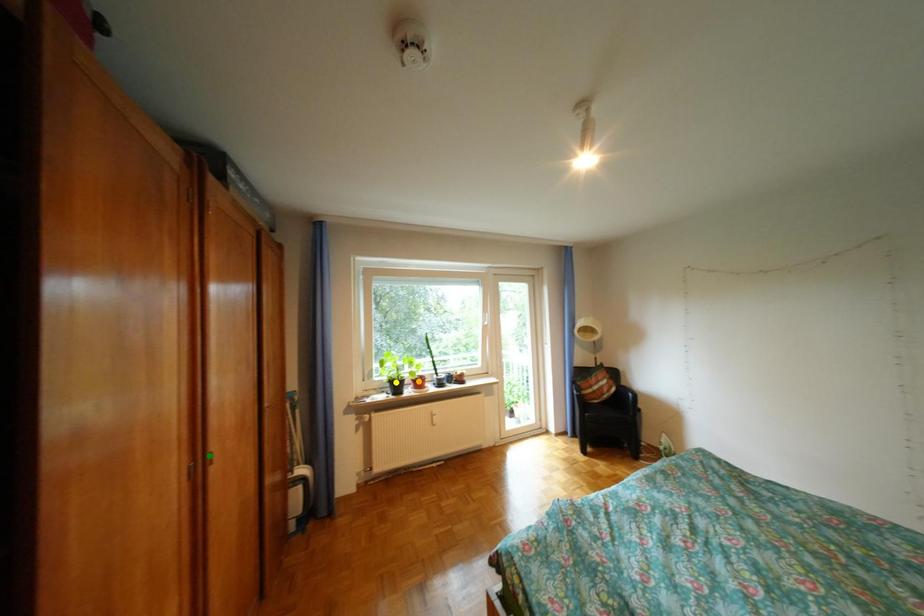
Order these from nearest to farthest:
yellow point, orange point, green point

green point, yellow point, orange point